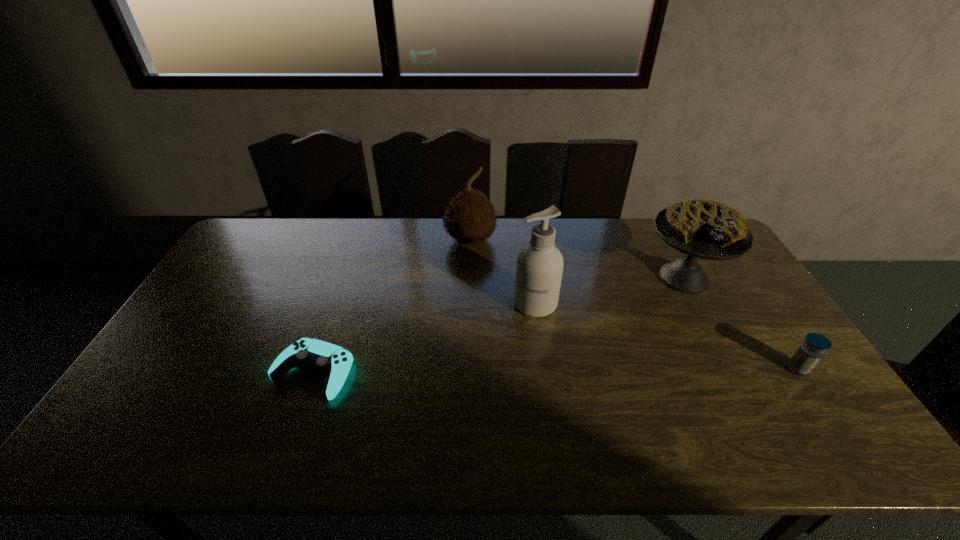
The width and height of the screenshot is (960, 540). What are the coordinates of `the shortest object` in the screenshot? It's located at (333, 362).

Where is `control`? This screenshot has height=540, width=960. control is located at coordinates (333, 362).

This screenshot has height=540, width=960. I want to click on the rightmost object, so click(x=810, y=352).

Find the location of `the second shortest object`. the second shortest object is located at coordinates (810, 352).

The height and width of the screenshot is (540, 960). I want to click on pie, so click(702, 229).

Locate an element on the screen. cleansing agent is located at coordinates (539, 269).

Locate an element on the screen. Image resolution: width=960 pixels, height=540 pixels. the tallest object is located at coordinates (539, 269).

Locate an element on the screen. coconut is located at coordinates (469, 218).

This screenshot has height=540, width=960. I want to click on vacant space located on the left of the control, so click(252, 372).

Find the location of a particular element. The height and width of the screenshot is (540, 960). free space located 0.120m on the left of the medicine is located at coordinates (743, 369).